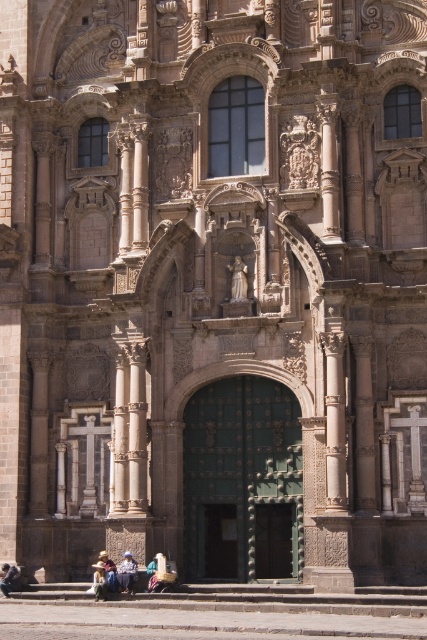
Question: Can you confirm if matte stone statue at center is positioned below light brown leather jacket at lower center?

Choices:
 (A) no
 (B) yes

Answer: (A)

Question: Which point is closer to the camera?

Choices:
 (A) stone steps at center
 (B) light brown woven hat at lower center

Answer: (A)

Question: Does stone steps at center have a larger size compared to light brown woven hat at lower center?

Choices:
 (A) no
 (B) yes

Answer: (B)

Question: Does light brown leather jacket at lower center appear under blue denim jeans at lower center?

Choices:
 (A) no
 (B) yes

Answer: (A)

Question: Which of the following is the closest to the observer?

Choices:
 (A) light brown woven hat at lower center
 (B) stone steps at center

Answer: (B)

Question: Estimate the real-world distances between objects in this image. Which object is closer to the matte stone statue at center?

Choices:
 (A) blue denim jeans at lower center
 (B) light brown woven hat at lower center

Answer: (B)